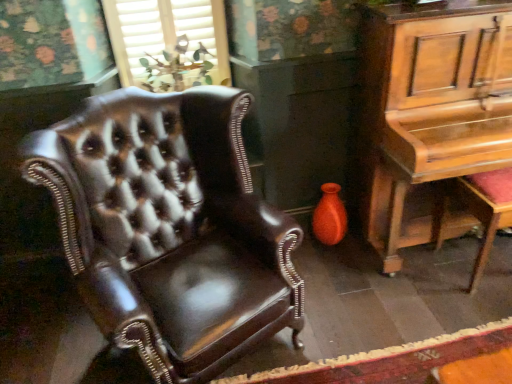
This screenshot has width=512, height=384. What are the coordinates of `vacant area that lies between matte orange vase at lower right and wooden piano at right` in the screenshot? It's located at (352, 271).